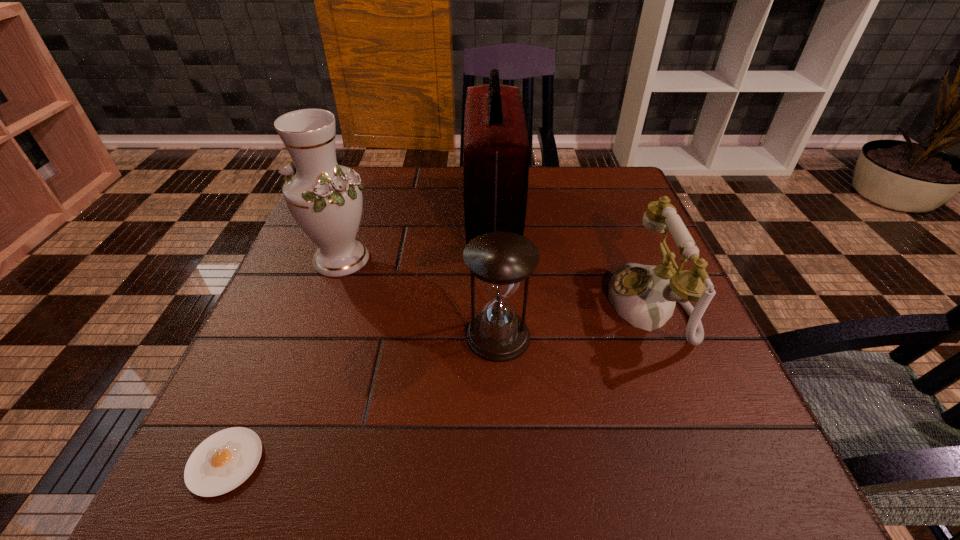
This screenshot has width=960, height=540. What are the coordinates of `free space that satisfies the following two spatial constraints: 1. on the side of the first aid kit with the cross symbol; 2. on the front side of the vase` in the screenshot? It's located at (494, 259).

The image size is (960, 540). I want to click on vacant space that satisfies the following two spatial constraints: 1. on the side of the hourglass with the cross symbol; 2. on the left side of the first aid kit, so click(x=497, y=336).

You are a GUI agent. You are given a task and a screenshot of the screen. Output one action in this format:
    pyautogui.click(x=<x>, y=<y>)
    Task: Click on the vacant space that satisfies the following two spatial constraints: 1. on the side of the first aid kit with the cross symbol; 2. on the back side of the hourglass
    
    Given the screenshot: What is the action you would take?
    pyautogui.click(x=497, y=336)